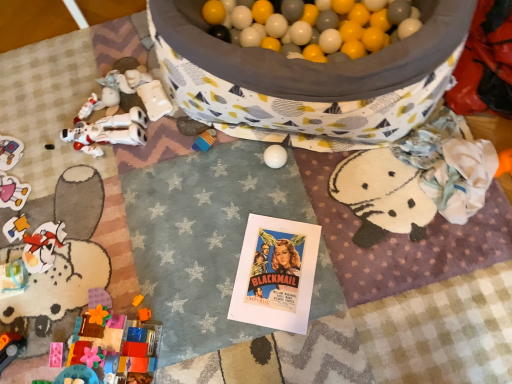
Where is `free point in front of white matte robot at left, acting as the second toy starting from the back`? free point in front of white matte robot at left, acting as the second toy starting from the back is located at coordinates (108, 191).